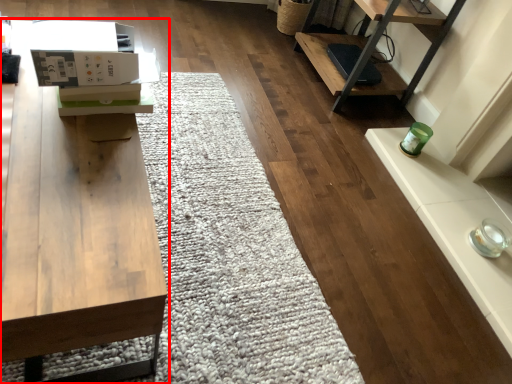
Question: From the image, what is the correct spatial relationship of table (annotated by the red box) in relation to cardboard box?

Choices:
 (A) right
 (B) left

Answer: (B)